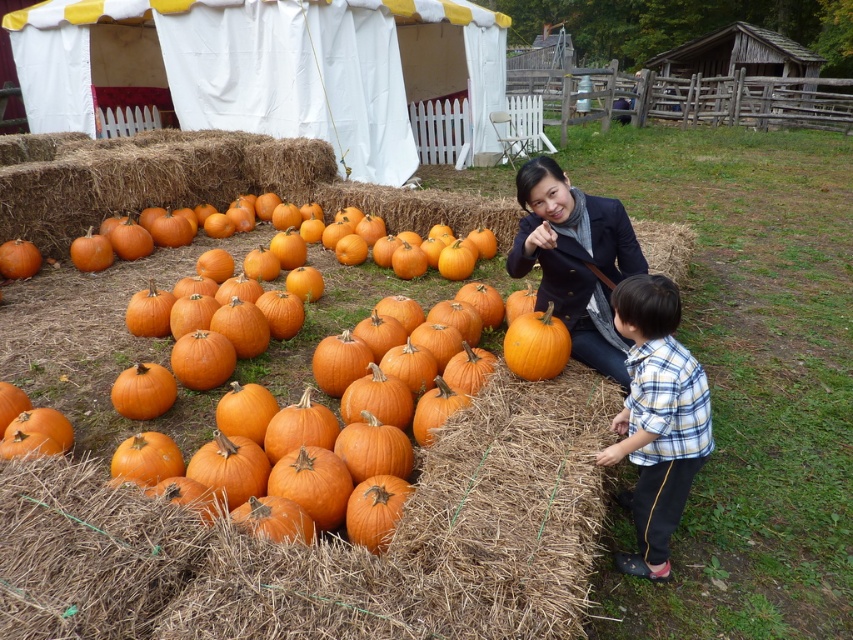
Question: Among these objects, which one is farthest from the camera?

Choices:
 (A) orange matte pumpkin at center
 (B) orange matte pumpkin at left
 (C) matte black coat at center
 (D) yellow plaid shirt at lower right

Answer: (B)

Question: Can you confirm if yellow plaid shirt at lower right is wider than orange matte pumpkin at left?

Choices:
 (A) no
 (B) yes

Answer: (B)

Question: Based on their relative distances, which object is nearer to the orange matte pumpkin at center?

Choices:
 (A) matte black coat at center
 (B) orange matte pumpkin at left
 (C) yellow plaid shirt at lower right

Answer: (A)

Question: Among these points, which one is nearest to the camera?

Choices:
 (A) (643, 353)
 (B) (18, 248)
 (C) (601, 337)
 (D) (540, 368)

Answer: (A)

Question: Can you confirm if yellow plaid shirt at lower right is smaller than matte black coat at center?

Choices:
 (A) yes
 (B) no

Answer: (A)

Question: Can you confirm if matte black coat at center is positioned to the left of orange matte pumpkin at center?

Choices:
 (A) yes
 (B) no

Answer: (B)